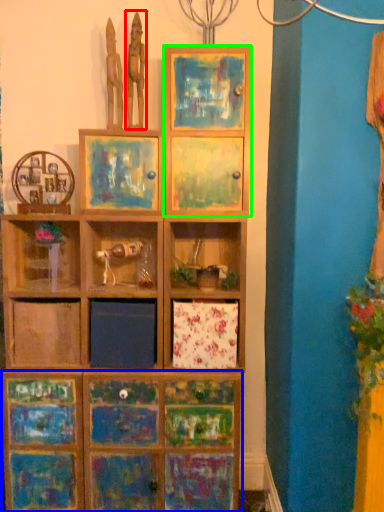
Question: Estimate the real-world distances between objects in this image. Which object is farther from sculpture (highlighted by a red box), cabinetry (highlighted by a blue box) or cabinet (highlighted by a green box)?

Choices:
 (A) cabinetry
 (B) cabinet

Answer: (A)